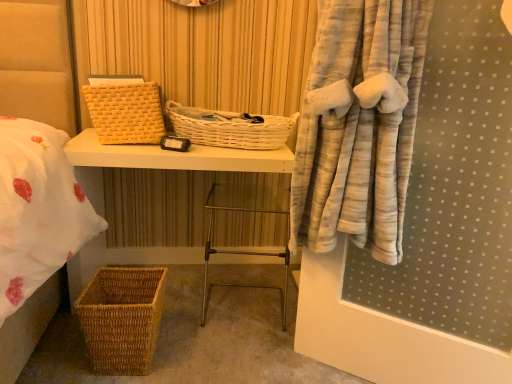
The image size is (512, 384). Identify the location of free area in between metallic silver step stool at center and woven brown basket at lower left, which is the 3th basket in top-to-bottom order. (201, 342).